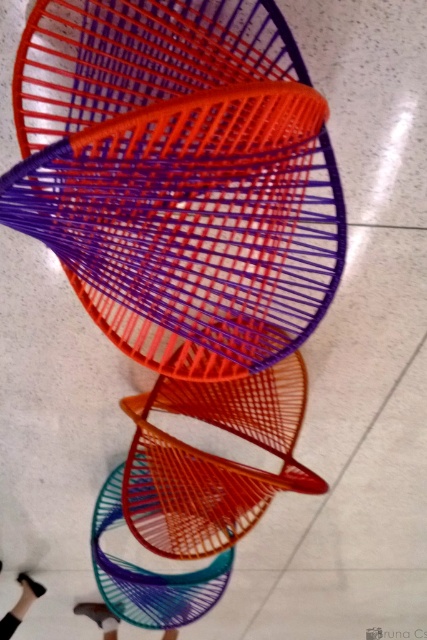
Question: Which of the following is the farthest from the observer?

Choices:
 (A) (2, 628)
 (B) (289, 28)
 (C) (102, 627)
 (D) (107, 566)

Answer: (C)

Question: Is black leather shoe at lower left further to camera compared to metallic silver shoe at lower center?

Choices:
 (A) no
 (B) yes

Answer: (A)

Question: Estimate the real-world distances between objects in this image. Which object is closer to the orange matte wire spiral at center?

Choices:
 (A) teal matte wire chair at center
 (B) black leather shoe at lower left
 (C) orange matte chair at center

Answer: (C)

Question: Which object appears farthest from the camera in this image?

Choices:
 (A) teal matte wire chair at center
 (B) black leather shoe at lower left
 (C) orange matte chair at center

Answer: (B)

Question: Is black leather shoe at lower left to the right of metallic silver shoe at lower center from the viewer's perspective?

Choices:
 (A) no
 (B) yes

Answer: (A)

Question: Is teal matte wire chair at center closer to camera compared to black leather shoe at lower left?

Choices:
 (A) no
 (B) yes

Answer: (B)